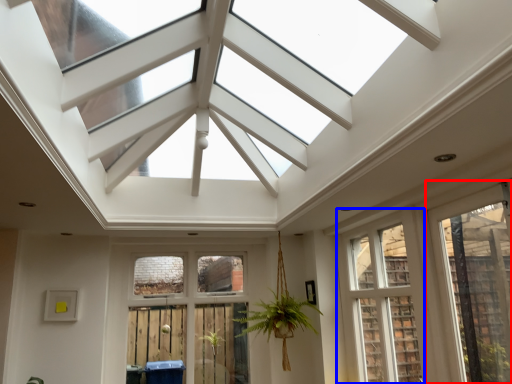
Question: Which object appears closest to the camera in this image, window (highlighted by a red box) or window (highlighted by a blue box)?

Choices:
 (A) window
 (B) window

Answer: (A)